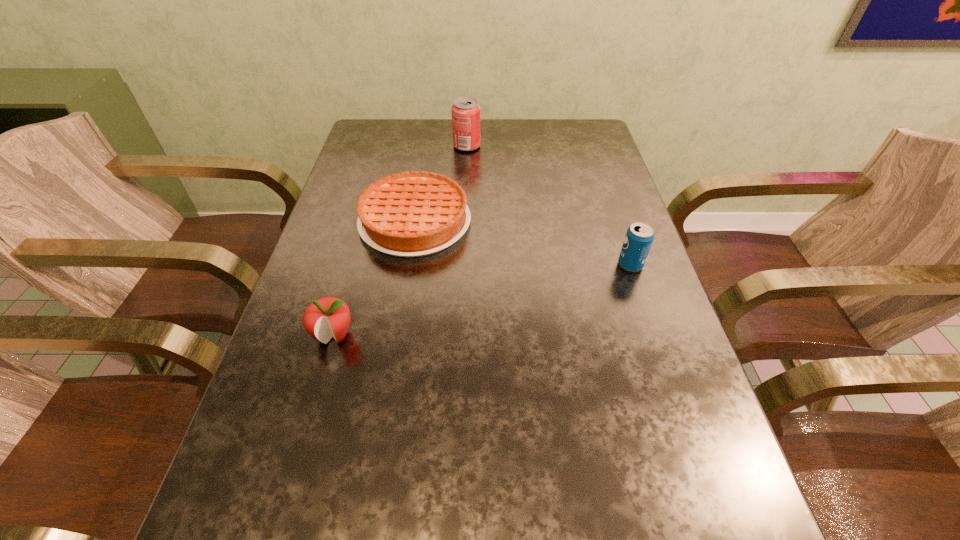
Find the location of `the farthest object`. the farthest object is located at coordinates (466, 111).

Locate an element on the screen. The width and height of the screenshot is (960, 540). the farther soda can is located at coordinates (466, 111).

This screenshot has height=540, width=960. I want to click on the rightmost object, so click(639, 236).

At what (x,y) coordinates should I click in order to perform the action: click on the shorter soda can. Please return your answer as a coordinate pair (x, y). Looking at the image, I should click on (639, 236).

Locate an element on the screen. the nearest object is located at coordinates (328, 317).

The image size is (960, 540). In order to click on pie in this screenshot , I will do `click(410, 214)`.

The height and width of the screenshot is (540, 960). In order to click on vacant space located on the left of the tallest object in this screenshot , I will do `click(438, 146)`.

Locate an element on the screen. vacant space located on the front of the rightmost object is located at coordinates (646, 311).

The height and width of the screenshot is (540, 960). What are the coordinates of `vacant space located 0.360m on the right of the nearest object` in the screenshot? It's located at (536, 335).

I want to click on free space located 0.070m on the right of the shortest object, so click(498, 222).